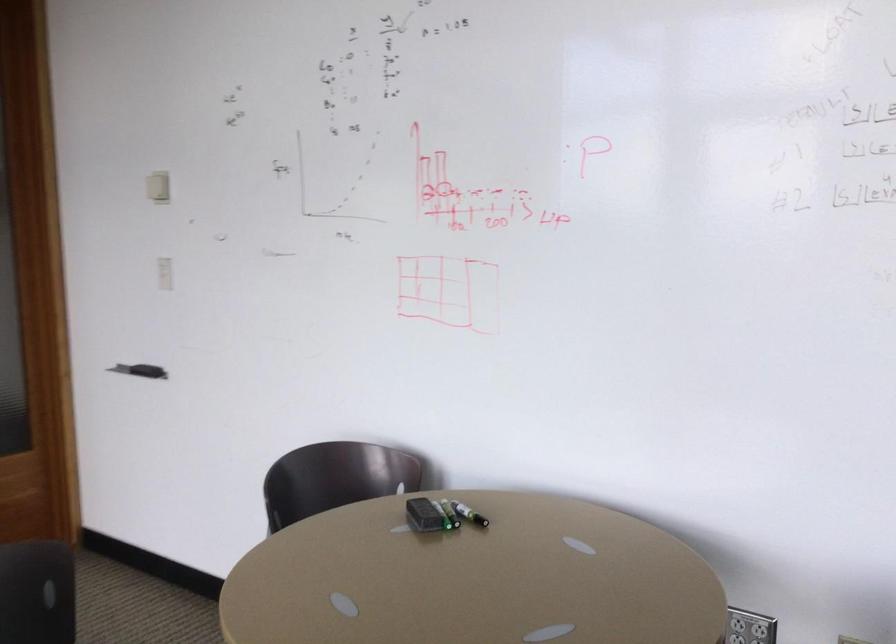
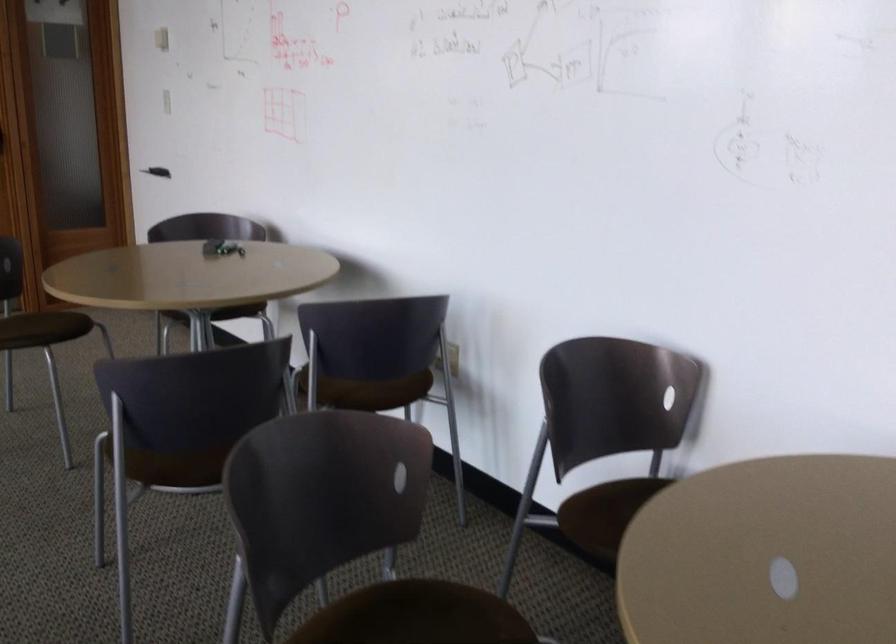
What movement of the cameraman would produce the second image?

The cameraman moved toward right, backward.